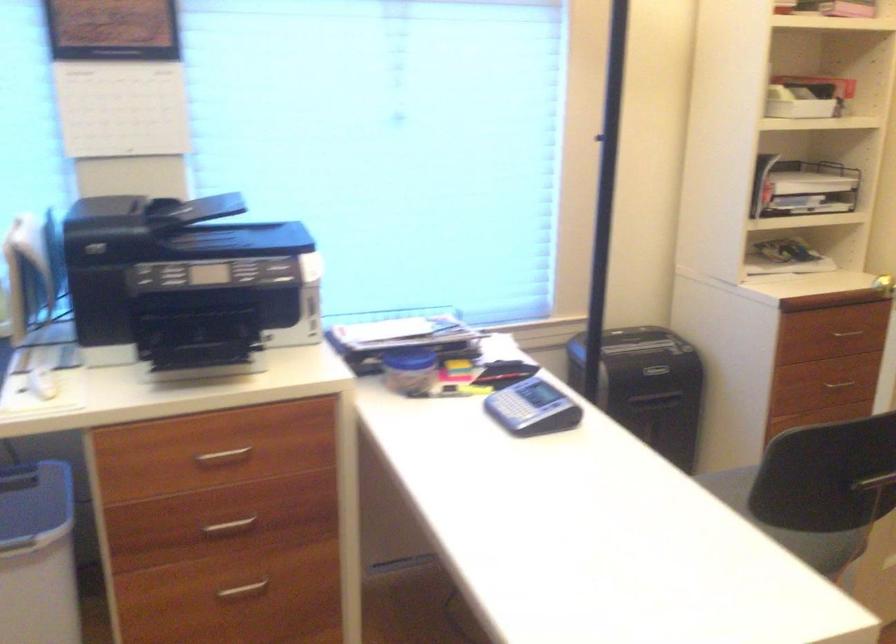
Where would you lift the blue waste bin? Please return your answer as a coordinate pair (x, y).

(35, 513)